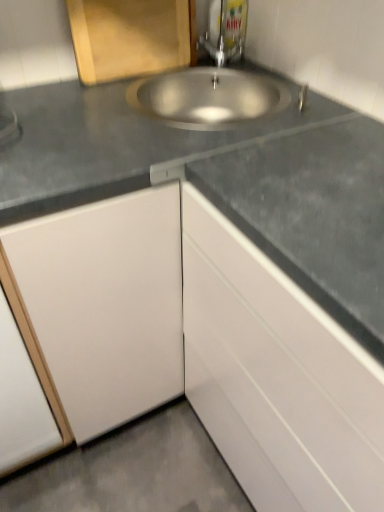
Question: Is wooden cutting board at upper left, placed as the first cabinetry when sorted from top to bottom, located within metallic faucet at upper center?

Choices:
 (A) yes
 (B) no

Answer: (B)

Question: Is metallic faucet at upper center further to camera compared to wooden cutting board at upper left, which is the 1th cabinetry from left to right?

Choices:
 (A) no
 (B) yes

Answer: (B)

Question: From a real-world perspective, is metallic faucet at upper center over wooden cutting board at upper left, which ranks as the second cabinetry in right-to-left order?

Choices:
 (A) no
 (B) yes

Answer: (B)

Question: Is metallic faucet at upper center not close to wooden cutting board at upper left, positioned as the 2th cabinetry in bottom-to-top order?

Choices:
 (A) no
 (B) yes

Answer: (A)

Question: Is metallic faucet at upper center taller than wooden cutting board at upper left, positioned as the 2th cabinetry in bottom-to-top order?

Choices:
 (A) no
 (B) yes

Answer: (B)

Question: Would you say wooden cutting board at upper left, positioned as the 2th cabinetry in bottom-to-top order, is to the left or to the right of metallic faucet at upper center in the picture?

Choices:
 (A) left
 (B) right

Answer: (A)

Question: From the image's perspective, is wooden cutting board at upper left, which ranks as the second cabinetry in right-to-left order, positioned above or below metallic faucet at upper center?

Choices:
 (A) above
 (B) below

Answer: (B)

Question: In the image, is wooden cutting board at upper left, placed as the first cabinetry when sorted from top to bottom, positioned in front of or behind metallic faucet at upper center?

Choices:
 (A) front
 (B) behind

Answer: (A)

Question: Looking at the image, does wooden cutting board at upper left, which is the 1th cabinetry from left to right, seem bigger or smaller compared to metallic faucet at upper center?

Choices:
 (A) big
 (B) small

Answer: (B)

Question: From a real-world perspective, relative to wooden cutting board at upper left, which ranks as the second cabinetry in right-to-left order, is white glossy cabinet at lower right, positioned as the 2th cabinetry in top-to-bottom order, vertically above or below?

Choices:
 (A) below
 (B) above

Answer: (A)

Question: Would you say white glossy cabinet at lower right, arranged as the second cabinetry when viewed from the left, is inside or outside wooden cutting board at upper left, which is the 1th cabinetry from left to right?

Choices:
 (A) inside
 (B) outside

Answer: (B)

Question: In the image, is white glossy cabinet at lower right, positioned as the 2th cabinetry in top-to-bottom order, positioned in front of or behind wooden cutting board at upper left, which is the 1th cabinetry from left to right?

Choices:
 (A) front
 (B) behind

Answer: (A)

Question: Looking at their shapes, would you say white glossy cabinet at lower right, arranged as the second cabinetry when viewed from the left, is wider or thinner than wooden cutting board at upper left, positioned as the 2th cabinetry in bottom-to-top order?

Choices:
 (A) wide
 (B) thin

Answer: (A)

Question: Visually, is metallic faucet at upper center positioned to the left or to the right of wooden cutting board at upper left, which is the 1th cabinetry from left to right?

Choices:
 (A) left
 (B) right

Answer: (B)

Question: Does point (216, 33) appear closer or farther from the camera than point (105, 33)?

Choices:
 (A) closer
 (B) farther

Answer: (B)